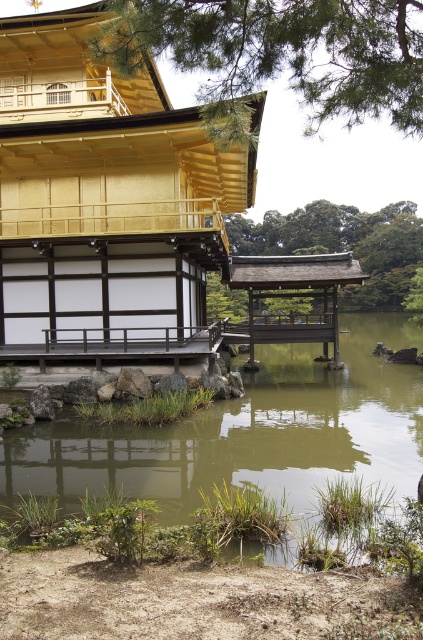
You are standing at the center of the image and want to reach the golden polished wood temple at upper left. In which general direction should you move?

You should move towards the upper left direction to reach the golden polished wood temple at upper left since it is located at point (104, 202), which is in the upper left quadrant of the image.

You are a visitor standing at the entrance of the golden polished wood temple at upper left and want to reach the green grassy water at center. Which direction should you walk to move towards it?

The green grassy water at center is behind the golden polished wood temple at upper left, so you should walk away from the temple in the opposite direction of the entrance to reach it.